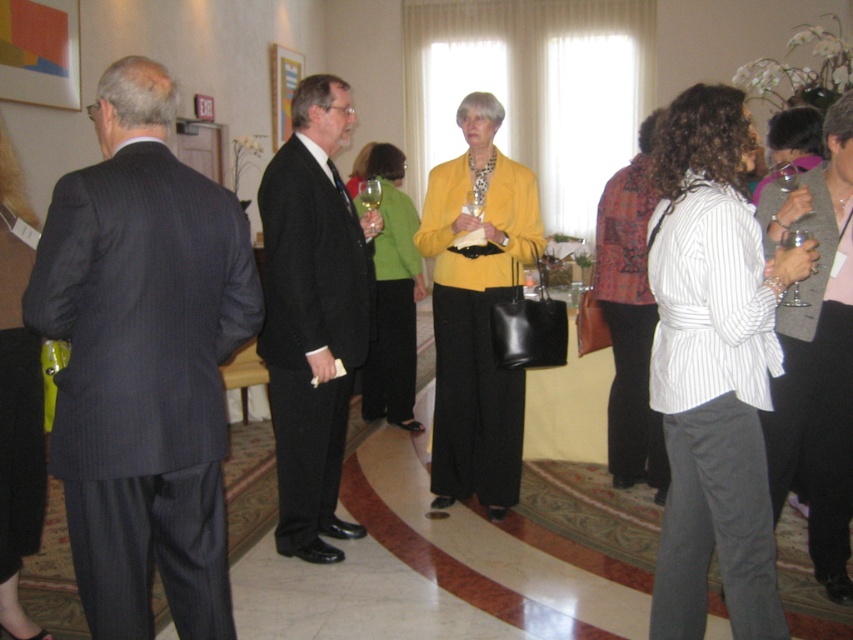
Does patchwork jacket at center have a larger size compared to clear glass wine glass at center right?

Indeed, patchwork jacket at center has a larger size compared to clear glass wine glass at center right.

Does patchwork jacket at center appear under clear glass wine glass at center right?

Indeed, patchwork jacket at center is positioned under clear glass wine glass at center right.

Who is more forward, (621, 292) or (802, 232)?

Point (802, 232) is more forward.

This screenshot has width=853, height=640. In order to click on patchwork jacket at center in this screenshot , I will do `click(630, 320)`.

Is dark pinstripe suit at left thinner than striped cotton shirt at center?

No, dark pinstripe suit at left is not thinner than striped cotton shirt at center.

Between dark pinstripe suit at left and striped cotton shirt at center, which one is positioned lower?

striped cotton shirt at center is below.

Identify the location of dark pinstripe suit at left. (143, 362).

Can you confirm if dark pinstripe suit at left is taller than matte yellow jacket at center?

Incorrect, dark pinstripe suit at left's height is not larger of matte yellow jacket at center's.

Does dark pinstripe suit at left have a larger size compared to matte yellow jacket at center?

No, dark pinstripe suit at left is not bigger than matte yellow jacket at center.

Is point (109, 525) behind point (379, 266)?

No, it is not.

Identify the location of dark pinstripe suit at left. The image size is (853, 640). (143, 362).